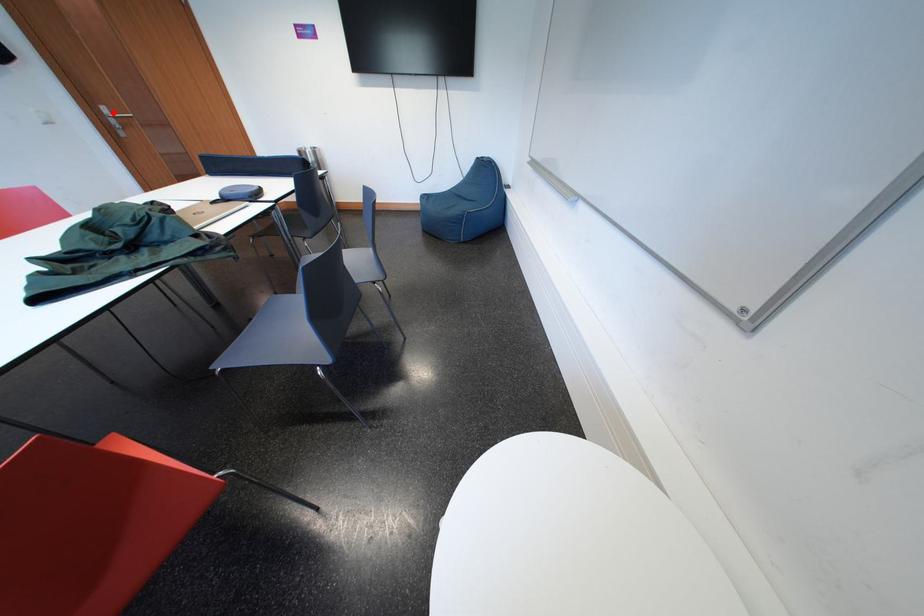
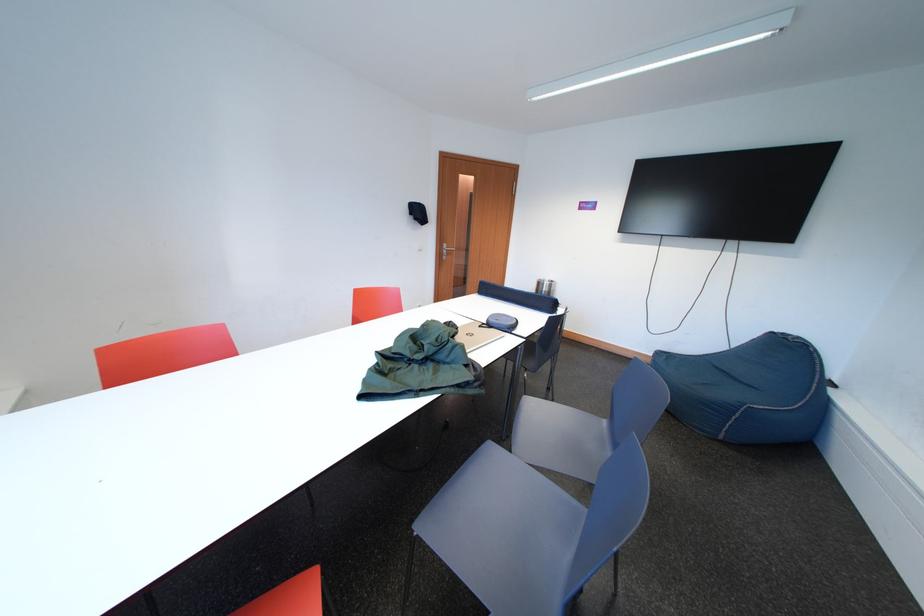
Where in the second image is the point corresponding to the highlighted location from the first image?

(455, 249)